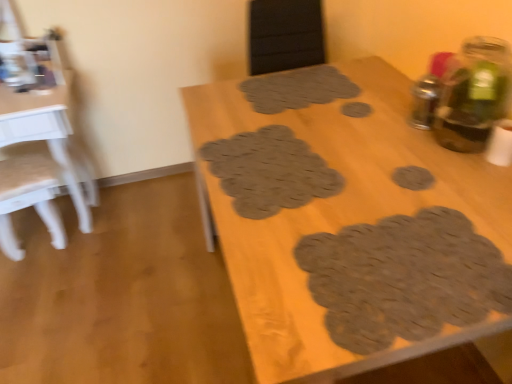
Identify the location of spots to the right of brown textured mat at center, the 5th footprint from the front. This screenshot has width=512, height=384. (372, 82).